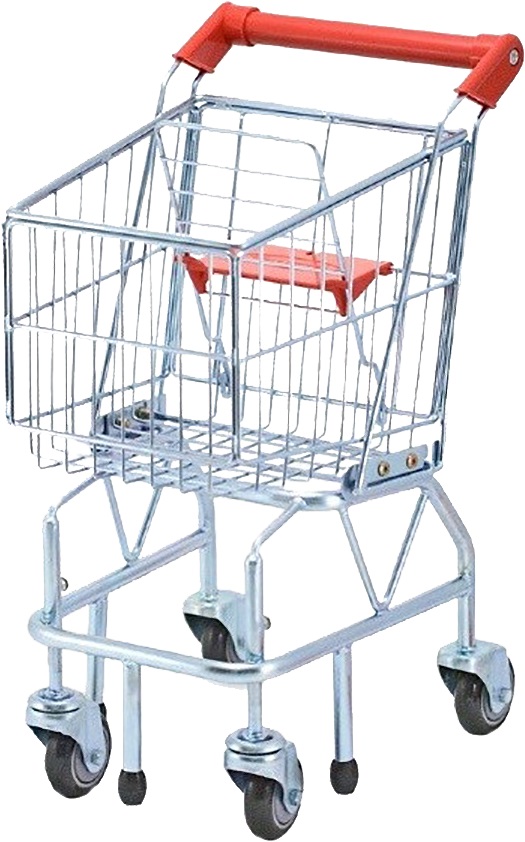
At what (x,y) coordinates should I click in order to perform the action: click on corner handle covers. Please return your answer as a coordinate pair (x, y). Looking at the image, I should click on (490, 49), (224, 13).